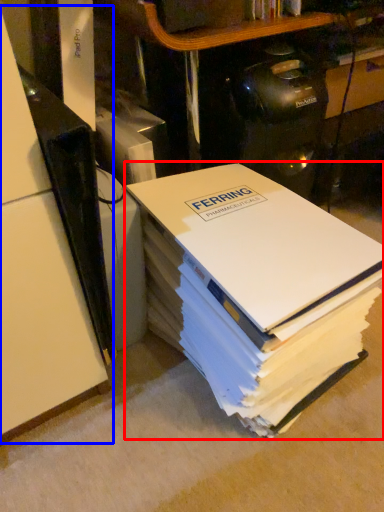
Question: Which of the following is the closest to the observer, book (highlighted by a red box) or shelf (highlighted by a blue box)?

Choices:
 (A) book
 (B) shelf

Answer: (A)